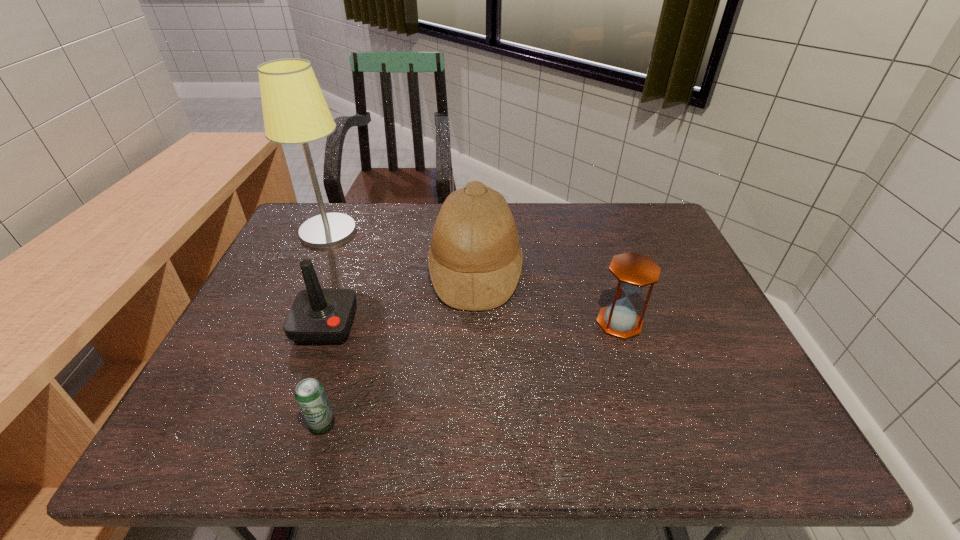
Find the location of a particular element. The width and height of the screenshot is (960, 540). free spot located 0.200m on the left of the rightmost object is located at coordinates (515, 322).

I want to click on free spot located on the right of the shortest object, so click(x=437, y=424).

You are a GUI agent. You are given a task and a screenshot of the screen. Output one action in this format:
    pyautogui.click(x=<x>, y=<y>)
    Task: Click on the table lamp at the far edge
    
    Given the screenshot: What is the action you would take?
    pyautogui.click(x=295, y=111)

At what (x,y) coordinates should I click in order to perform the action: click on hat that is at the far edge. Please return your answer as a coordinate pair (x, y). The image size is (960, 540). Looking at the image, I should click on (475, 260).

Where is `object situated at the near edge`? The width and height of the screenshot is (960, 540). object situated at the near edge is located at coordinates (310, 395).

Find the location of a particular element. table lamp that is at the left edge is located at coordinates (295, 111).

Where is `joystick located in the left edge section of the desktop`? joystick located in the left edge section of the desktop is located at coordinates (318, 316).

Where is `object located in the far left corner section of the desktop`? object located in the far left corner section of the desktop is located at coordinates (295, 111).

Where is `vacant space at the far edge of the desktop`? The width and height of the screenshot is (960, 540). vacant space at the far edge of the desktop is located at coordinates (402, 202).

Locate an element on the screen. The height and width of the screenshot is (540, 960). vacant space at the near edge of the desktop is located at coordinates (410, 441).